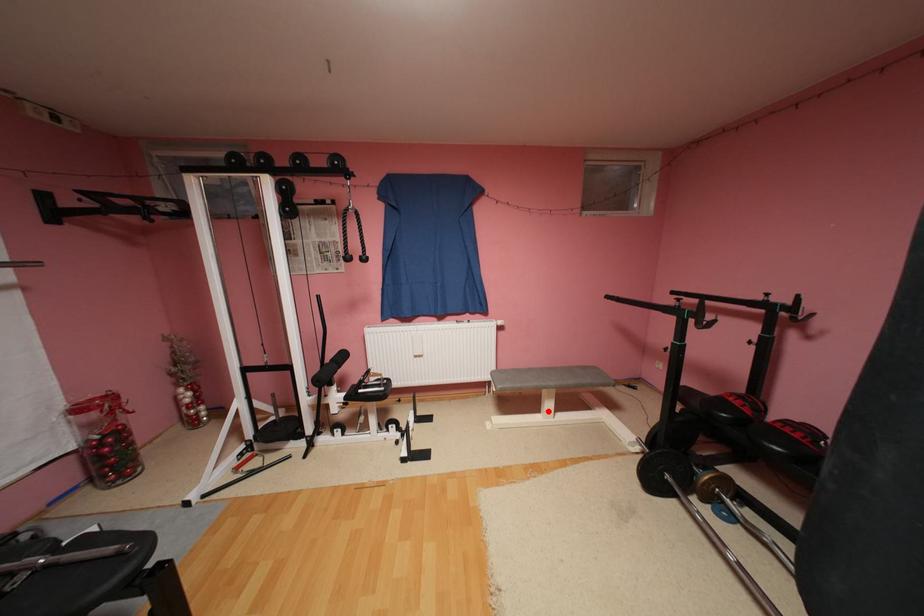
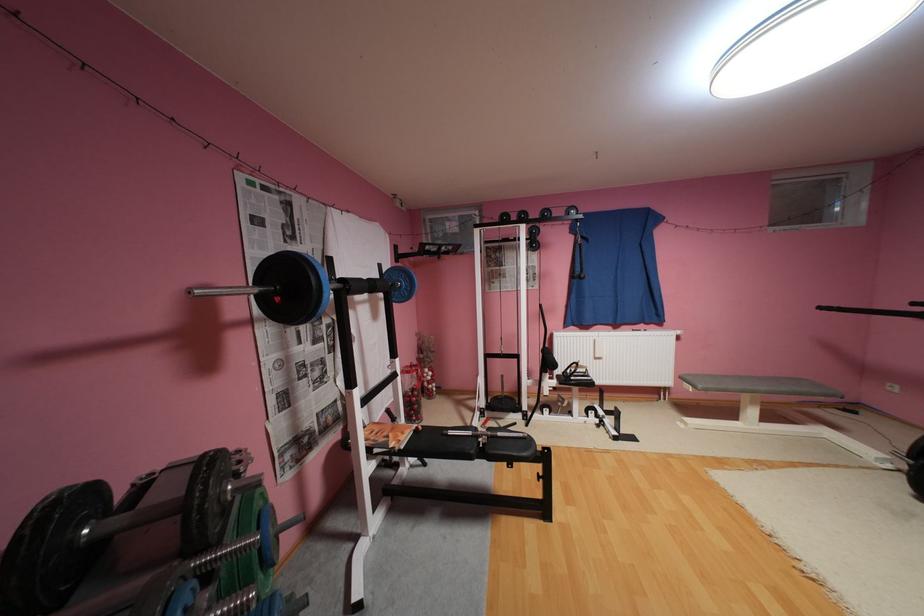
Question: I am providing you with two images of the same scene from different viewpoints. A red point is shown in image1. For the corresponding object point in image2, is it positioned nearer or farther from the camera?

Choices:
 (A) Nearer
 (B) Farther

Answer: (A)